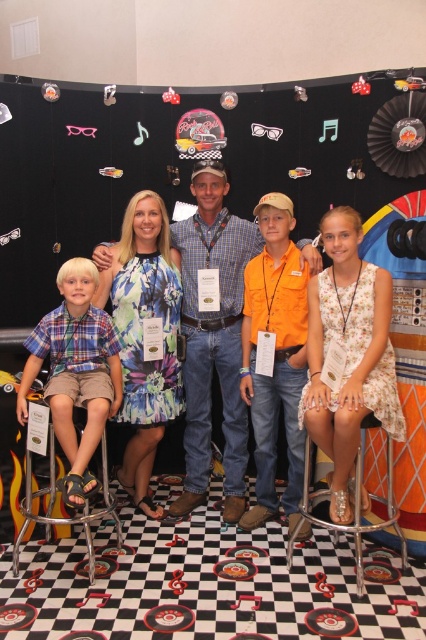
This screenshot has width=426, height=640. I want to click on plaid cotton shirt at left, so click(75, 371).

Can you confirm if plaid cotton shirt at left is wider than metallic silver bar stool at lower center?

In fact, plaid cotton shirt at left might be narrower than metallic silver bar stool at lower center.

Does point (97, 410) come closer to viewer compared to point (362, 554)?

Yes, it is in front of point (362, 554).

Identify the location of plaid cotton shirt at left. The height and width of the screenshot is (640, 426). (75, 371).

Consider the image. Which is more to the right, checkered fabric shirt at center or plaid cotton shirt at left?

From the viewer's perspective, checkered fabric shirt at center appears more on the right side.

Can you confirm if checkered fabric shirt at center is positioned to the right of plaid cotton shirt at left?

Indeed, checkered fabric shirt at center is positioned on the right side of plaid cotton shirt at left.

Is point (235, 413) farther from viewer compared to point (104, 323)?

Yes, it is behind point (104, 323).

Identify the location of checkered fabric shirt at center. Image resolution: width=426 pixels, height=640 pixels. (213, 337).

Can you confirm if checkered fabric shirt at center is positioned to the right of metallic silver bar stool at lower left?

Indeed, checkered fabric shirt at center is positioned on the right side of metallic silver bar stool at lower left.

Between checkered fabric shirt at center and metallic silver bar stool at lower left, which one is positioned lower?

metallic silver bar stool at lower left

Who is more distant from viewer, (215, 346) or (13, 554)?

Point (215, 346)

This screenshot has height=640, width=426. I want to click on checkered fabric shirt at center, so click(213, 337).